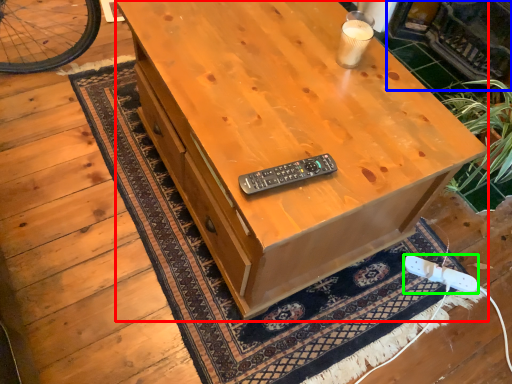
Question: Estimate the real-world distances between objects in this image. Which object is farther from desk (highlighted by a red box), fireplace (highlighted by a blue box) or game controller (highlighted by a green box)?

Choices:
 (A) fireplace
 (B) game controller

Answer: (A)